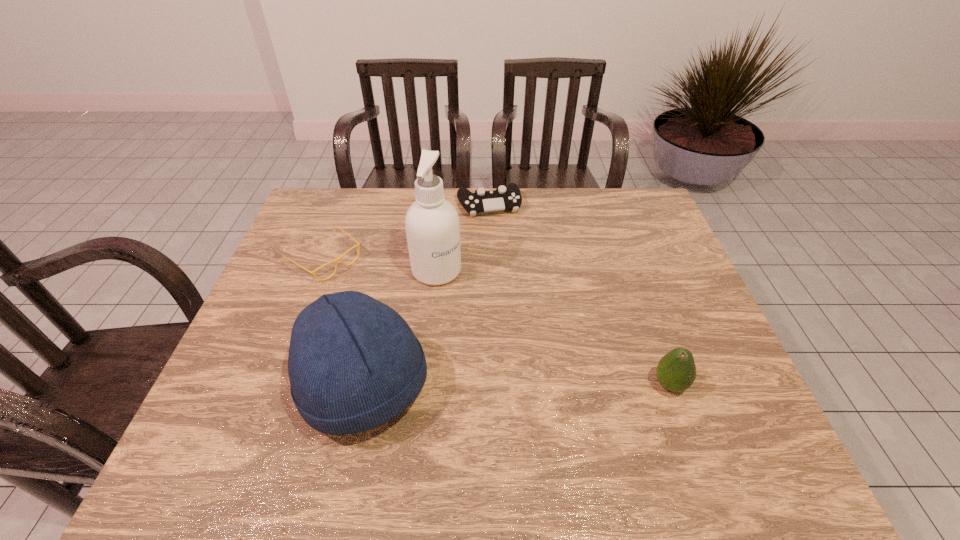
Where is `free space located 0.190m on the front label of the tallest object`? This screenshot has width=960, height=540. free space located 0.190m on the front label of the tallest object is located at coordinates (495, 325).

Locate an element on the screen. The height and width of the screenshot is (540, 960). free spot located 0.080m on the front label of the tallest object is located at coordinates (469, 300).

In order to click on vacant space located 0.390m on the surface of the control in this screenshot , I will do `click(523, 308)`.

Identify the location of vacant space located 0.140m on the surface of the control. (504, 247).

Where is `vacant area situated 0.060m on the surface of the control`? This screenshot has width=960, height=540. vacant area situated 0.060m on the surface of the control is located at coordinates (498, 232).

Where is `blank space located 0.350m in front of the lenses of the shortest object`? blank space located 0.350m in front of the lenses of the shortest object is located at coordinates tap(436, 340).

Locate an element on the screen. The height and width of the screenshot is (540, 960). vacant area situated in front of the lenses of the shortest object is located at coordinates (390, 306).

The image size is (960, 540). I want to click on vacant space located in front of the lenses of the shortest object, so click(x=371, y=292).

The image size is (960, 540). Identify the location of object located in the far edge section of the desktop. (502, 198).

What are the coordinates of `skullcap that is at the near edge` in the screenshot? It's located at (354, 363).